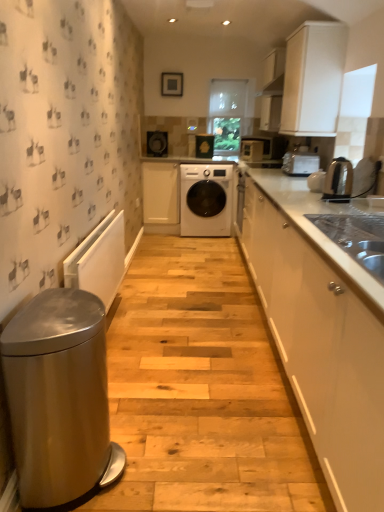
Identify the location of blank space to the left of metallic silver kettle at right, which appears as the 1th home appliance when ordered from the bottom. (301, 201).